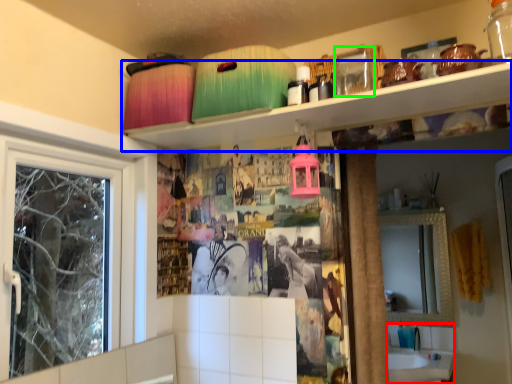
Question: Which object is positioned closest to sink (highlighted by a red box)? Select from shelf (highlighted by a blue box) and glass jar (highlighted by a green box).

Choices:
 (A) shelf
 (B) glass jar

Answer: (A)